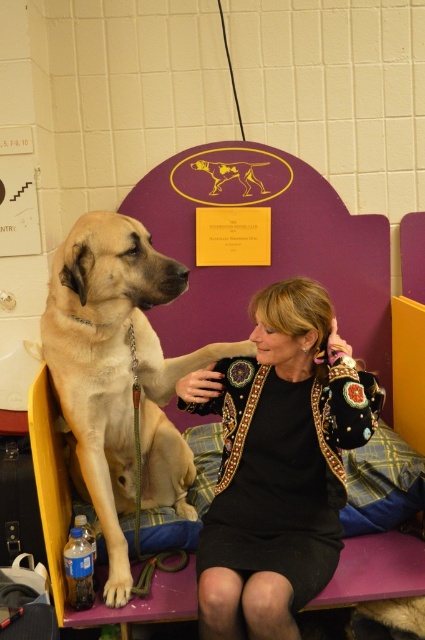
You are a photographer at the Westminster Kennel Club dog show. You need to capture a photo of the black textured jacket at center and the light brown fur at left. Which object is narrower in width?

The black textured jacket at center has a lesser width compared to the light brown fur at left, so the black textured jacket at center is narrower.

You are standing in the Westminster Kennel Club dog show venue. You see a purple bench with a large light tan dog sitting on it. There is a point marked at coordinates (x=277, y=464). What object is located at that point?

The point at coordinates (x=277, y=464) is on the black textured jacket at center.